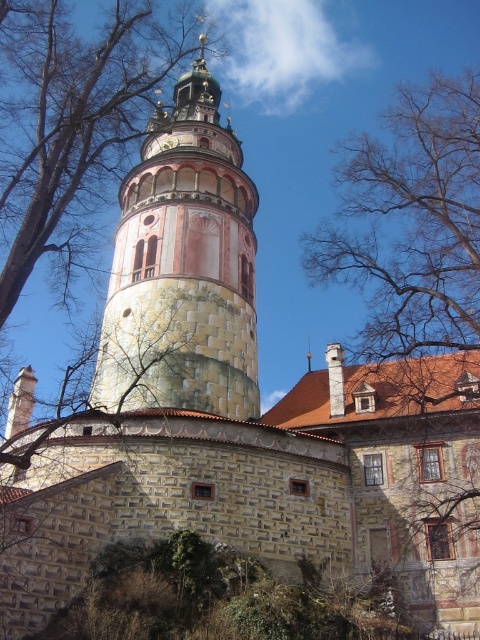
Question: Is stone tower at center positioned before metallic gold clock at center?

Choices:
 (A) yes
 (B) no

Answer: (A)

Question: Which of the following is the farthest from the observer?

Choices:
 (A) (166, 136)
 (B) (143, 342)

Answer: (A)

Question: Does stone tower at center appear on the left side of metallic gold clock at center?

Choices:
 (A) yes
 (B) no

Answer: (B)

Question: Is stone tower at center positioned at the back of metallic gold clock at center?

Choices:
 (A) yes
 (B) no

Answer: (B)

Question: Which object is closer to the camera taking this photo?

Choices:
 (A) metallic gold clock at center
 (B) stone tower at center

Answer: (B)